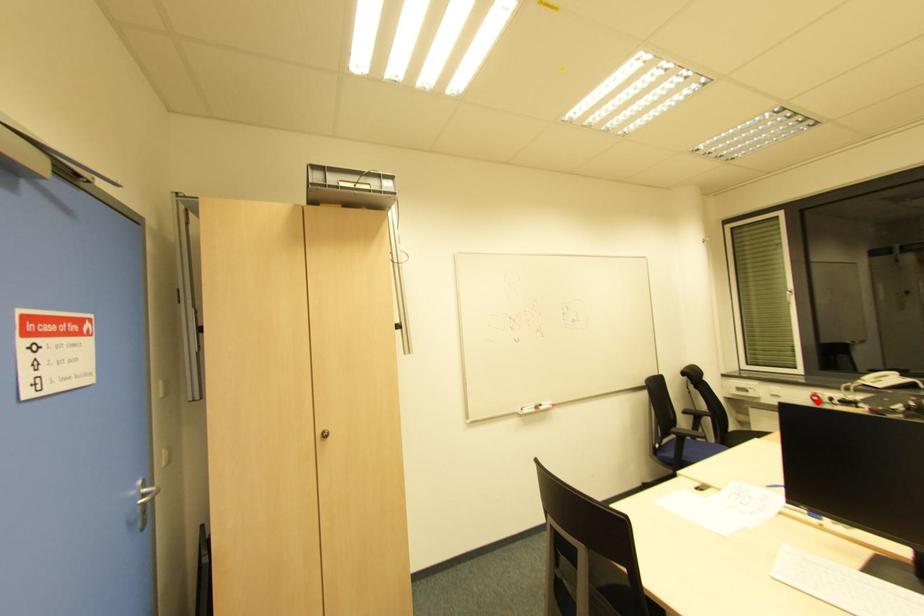
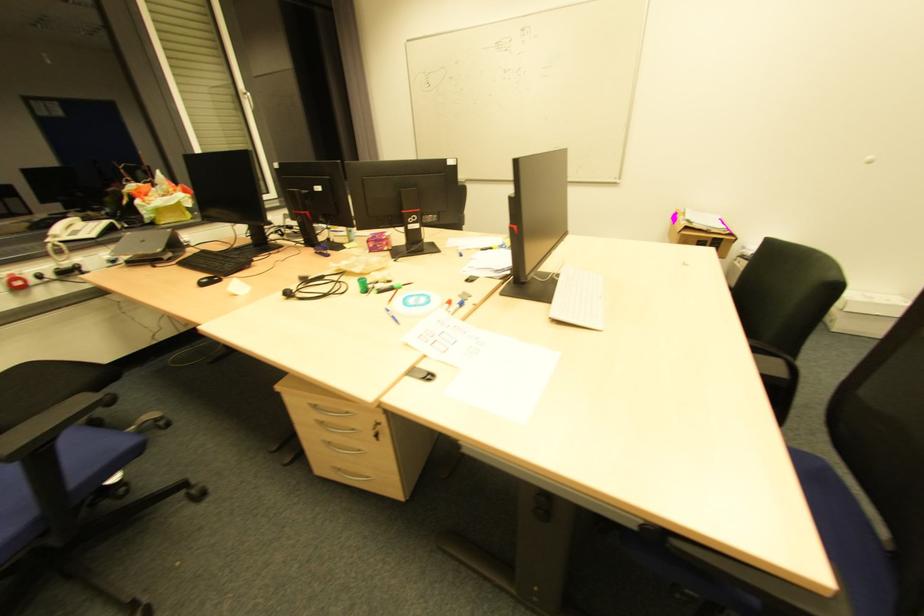
In the second image, find the point that corresponds to the highlighted location in the first image.

(17, 290)